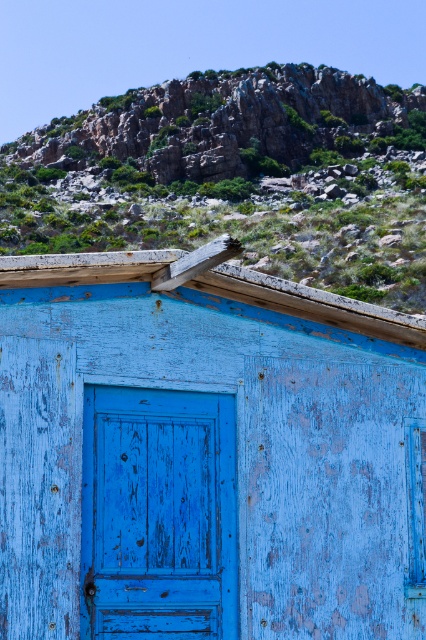
You are standing in front of the rustic wooden structure described. You notice the blue wooden door at center and the rusty rock at upper center. Which object is positioned higher up in the scene?

The rusty rock at upper center is positioned higher up in the scene than the blue wooden door at center.

Based on the photo, you are a painter who needs to apply a new coat of paint to both the rusty wood hut at center and the blue wooden door at center. If your ladder is 25 centimeters long, can you safely reach both objects without moving the ladder?

The rusty wood hut at center and blue wooden door at center are 30.27 centimeters apart from each other. Since the ladder is only 25 centimeters long, it is not long enough to cover the distance between them. Therefore, you will need to move the ladder to reach both objects.

You are a painter who needs to cover both the blue wooden door at center and the rusty rock at upper center with paint. If the door requires 1 liter of paint per square meter and the rock requires 0.5 liters per square meter, which object will require more paint considering their sizes?

The blue wooden door at center has a smaller size compared to rusty rock at upper center. Since the rock requires less paint per square meter but is larger in size, the total paint needed for the rusty rock at upper center would be more than the blue wooden door at center.